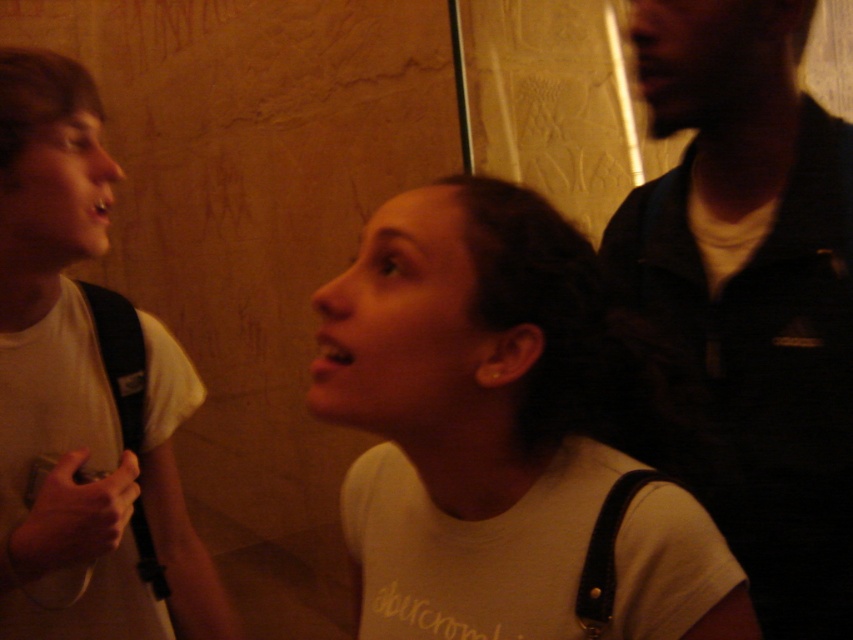
Question: Can you confirm if white matte shirt at center is smaller than dark blue shirt at upper right?

Choices:
 (A) no
 (B) yes

Answer: (B)

Question: Which object appears farthest from the camera in this image?

Choices:
 (A) dark blue shirt at upper right
 (B) white matte shirt at center

Answer: (A)

Question: Which point is farther to the camera?

Choices:
 (A) dark blue shirt at upper right
 (B) white matte shirt at center

Answer: (A)

Question: Does white matte shirt at center have a lesser width compared to dark blue shirt at upper right?

Choices:
 (A) yes
 (B) no

Answer: (B)

Question: Which object appears closest to the camera in this image?

Choices:
 (A) white matte shirt at center
 (B) dark blue shirt at upper right

Answer: (A)

Question: Is white matte shirt at center wider than dark blue shirt at upper right?

Choices:
 (A) no
 (B) yes

Answer: (B)